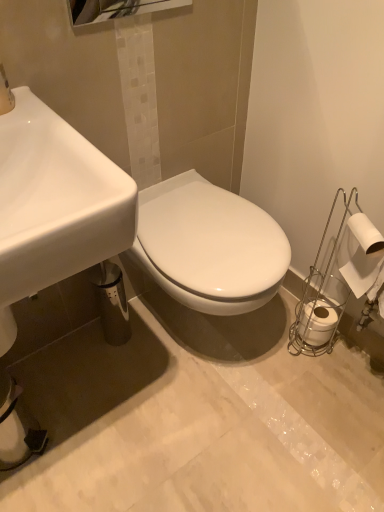
Question: Is point (52, 266) positioned closer to the camera than point (139, 7)?

Choices:
 (A) farther
 (B) closer

Answer: (B)

Question: Is white glossy sink at lower left to the left or to the right of polished chrome mirror at upper center in the image?

Choices:
 (A) left
 (B) right

Answer: (A)

Question: Which object is the closest to the white glossy sink at lower left?

Choices:
 (A) white matte toilet paper at right, the first toilet paper in the back-to-front sequence
 (B) white matte toilet paper at right, which is counted as the first toilet paper, starting from the front
 (C) polished chrome mirror at upper center

Answer: (C)

Question: Which object is the farthest from the white glossy sink at lower left?

Choices:
 (A) white matte toilet paper at right, which is counted as the first toilet paper, starting from the front
 (B) white matte toilet paper at right, positioned as the second toilet paper in front-to-back order
 (C) polished chrome mirror at upper center

Answer: (B)